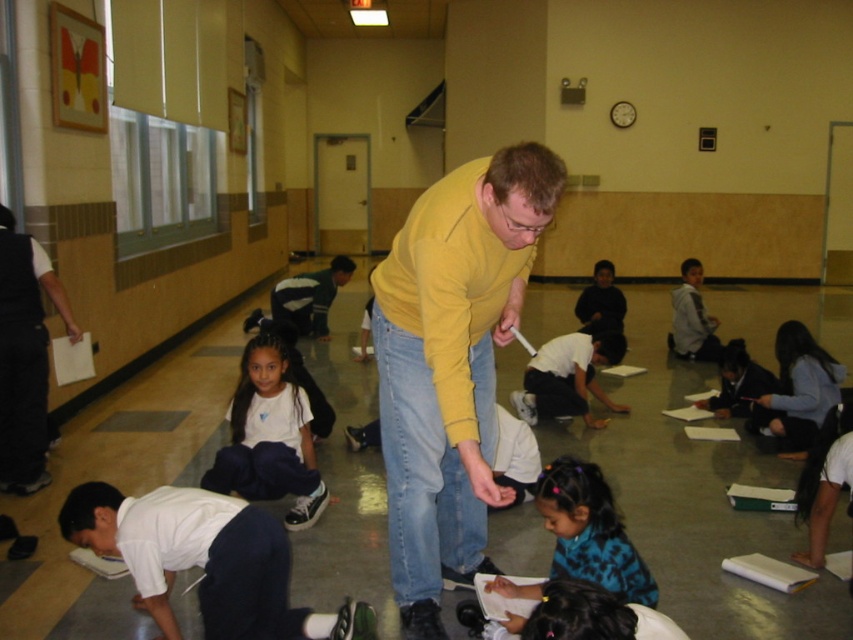
Which is in front, point (165, 561) or point (277, 365)?

Positioned in front is point (165, 561).

Does point (267, 636) come closer to viewer compared to point (270, 474)?

Yes.

In order to click on white smooth shirt at lower left in this screenshot , I will do `click(206, 561)`.

Looking at this image, who is higher up, yellow matte sweater at center or white matte shirt at lower left?

yellow matte sweater at center

Who is taller, yellow matte sweater at center or white matte shirt at lower left?

yellow matte sweater at center is taller.

Between point (416, 518) and point (271, 355), which one is positioned in front?

Point (416, 518) is more forward.

Locate an element on the screen. This screenshot has width=853, height=640. yellow matte sweater at center is located at coordinates (451, 364).

Is yellow matte sweater at center wider than black vest at left?

Indeed, yellow matte sweater at center has a greater width compared to black vest at left.

The image size is (853, 640). Describe the element at coordinates (451, 364) in the screenshot. I see `yellow matte sweater at center` at that location.

Image resolution: width=853 pixels, height=640 pixels. Find the location of `yellow matte sweater at center`. yellow matte sweater at center is located at coordinates (451, 364).